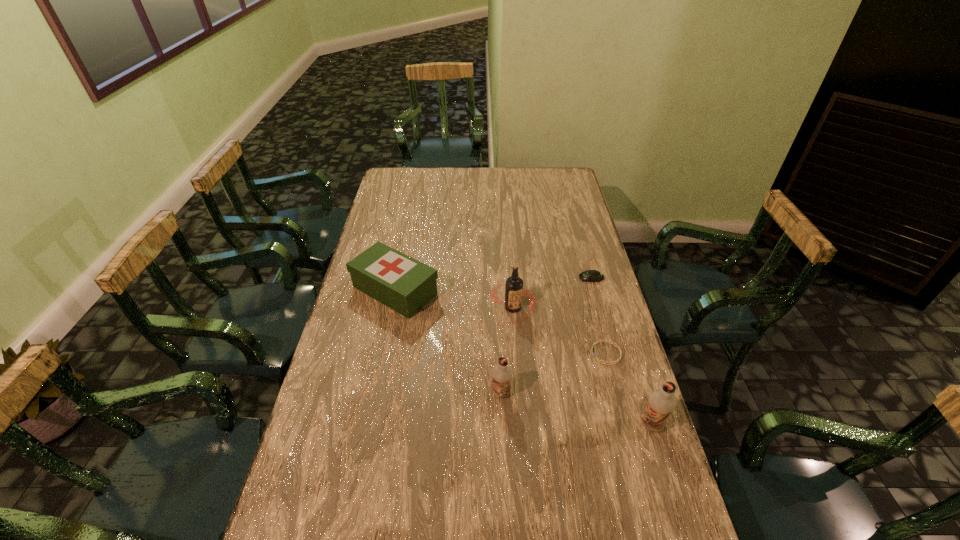
Find the location of `vacant region located 0.320m on the left of the farther chocolate milk`. vacant region located 0.320m on the left of the farther chocolate milk is located at coordinates (379, 393).

You are a GUI agent. You are given a task and a screenshot of the screen. Output one action in this format:
    pyautogui.click(x=<x>, y=<y>)
    Task: Click on the vacant space located 0.330m on the back of the right chocolate milk
    The width and height of the screenshot is (960, 540).
    Given the screenshot: What is the action you would take?
    pyautogui.click(x=620, y=323)

You are a GUI agent. You are given a task and a screenshot of the screen. Output one action in this format:
    pyautogui.click(x=<x>, y=<y>)
    Task: Click on the vacant area situated 0.170m on the label of the root beer
    This screenshot has width=960, height=540.
    Given the screenshot: What is the action you would take?
    pyautogui.click(x=517, y=368)

At what (x,y) coordinates should I click in order to perform the action: click on free region located on the wheel side of the second shortest object. Please return your answer as a coordinate pair (x, y). This screenshot has height=540, width=960. Looking at the image, I should click on (533, 278).

I want to click on free space located on the wheel side of the second shortest object, so click(x=516, y=278).

Find the location of a particular element. The height and width of the screenshot is (540, 960). free point located on the wheel side of the second shortest object is located at coordinates (494, 278).

The width and height of the screenshot is (960, 540). Identify the location of free region located on the surface of the bracelet showing star-shaped elements. (468, 353).

Image resolution: width=960 pixels, height=540 pixels. I want to click on free location located on the surface of the bracelet showing star-shaped elements, so click(537, 353).

Identify the location of free space located 0.060m on the surface of the bracelet showing star-shaped elements. The image size is (960, 540). (572, 353).

The image size is (960, 540). What are the coordinates of `blank space located on the back of the leftmost object` in the screenshot? It's located at (412, 212).